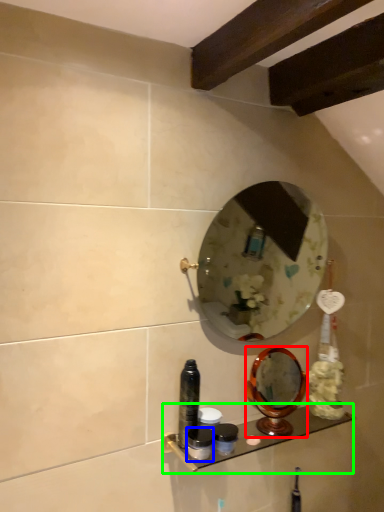
Question: Estimate the real-world distances between objects in this image. Which object is closer to mirror (highlighted by a red box), toiletry (highlighted by a blue box) or shelf (highlighted by a green box)?

Choices:
 (A) toiletry
 (B) shelf

Answer: (B)